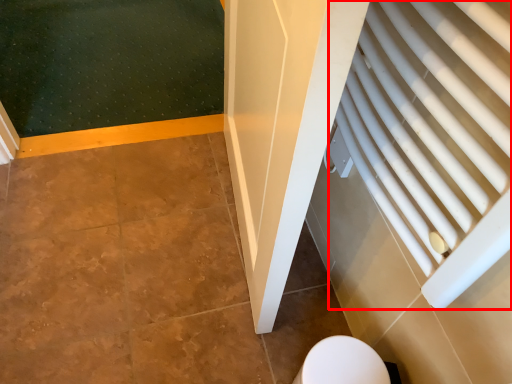
Question: Observing the image, what is the correct spatial positioning of curtain (annotated by the red box) in reference to toilet?

Choices:
 (A) left
 (B) right

Answer: (B)